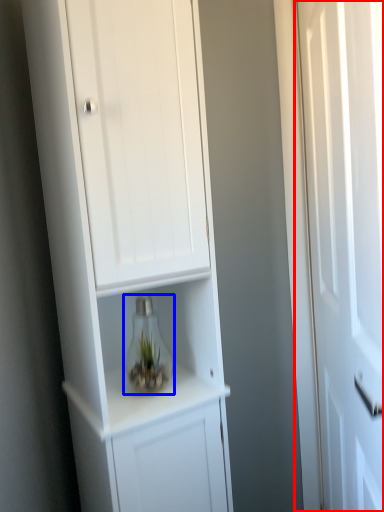
Question: Which of the following is the closest to the observer, door (highlighted by a red box) or glass vase (highlighted by a blue box)?

Choices:
 (A) door
 (B) glass vase

Answer: (A)